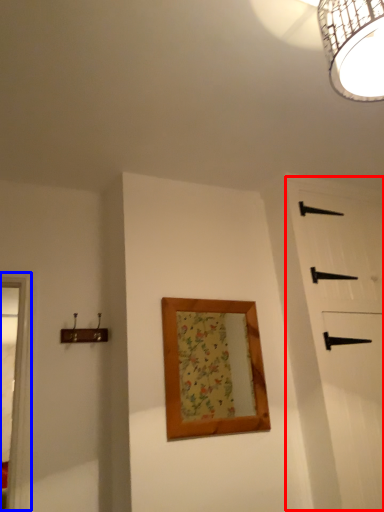
Question: Among these objects, which one is farthest to the camera, barn door (highlighted by a red box) or window frame (highlighted by a blue box)?

Choices:
 (A) barn door
 (B) window frame

Answer: (A)